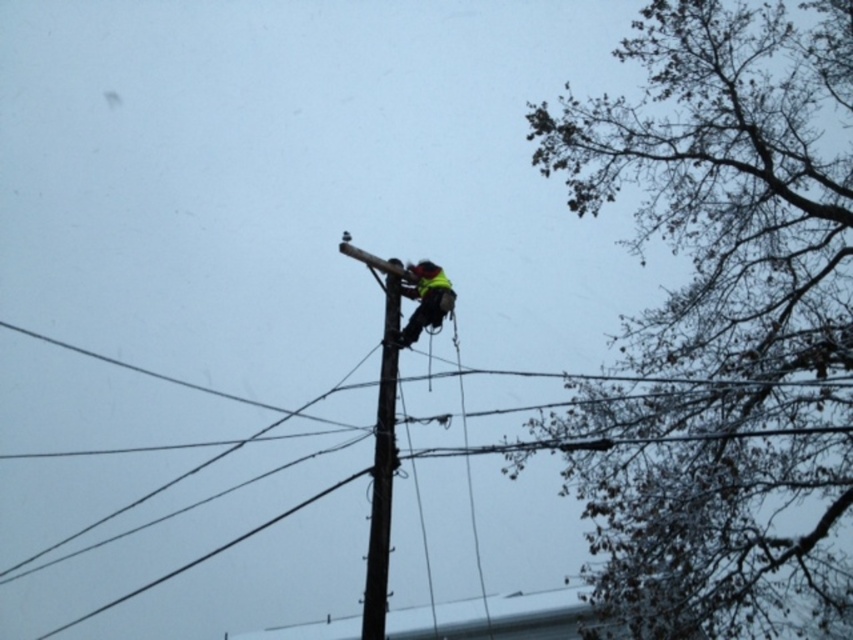
Question: Is brown leafy tree at upper right closer to the viewer compared to reflective yellow safety vest at center?

Choices:
 (A) yes
 (B) no

Answer: (B)

Question: Which object is positioned closest to the brown wooden telegraph pole at center?

Choices:
 (A) reflective yellow safety vest at center
 (B) brown leafy tree at upper right

Answer: (A)

Question: Where is brown wooden telegraph pole at center located in relation to reflective yellow safety vest at center in the image?

Choices:
 (A) right
 (B) left

Answer: (B)

Question: Which of the following is the closest to the observer?

Choices:
 (A) (375, 448)
 (B) (715, 336)
 (C) (416, 285)

Answer: (A)

Question: In this image, where is brown leafy tree at upper right located relative to reflective yellow safety vest at center?

Choices:
 (A) left
 (B) right

Answer: (B)

Question: Which point is farther to the camera?

Choices:
 (A) (724, 141)
 (B) (422, 275)
 (C) (384, 560)

Answer: (A)